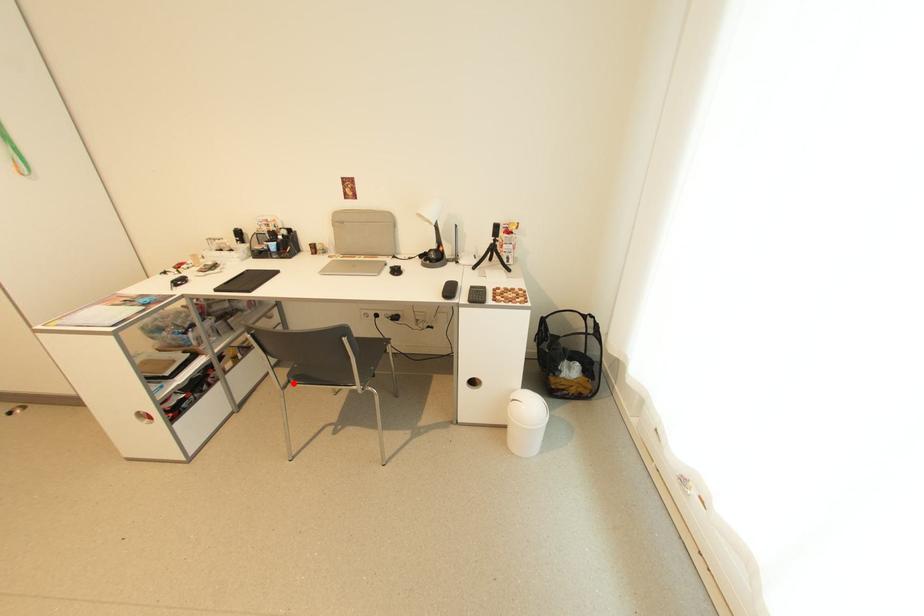
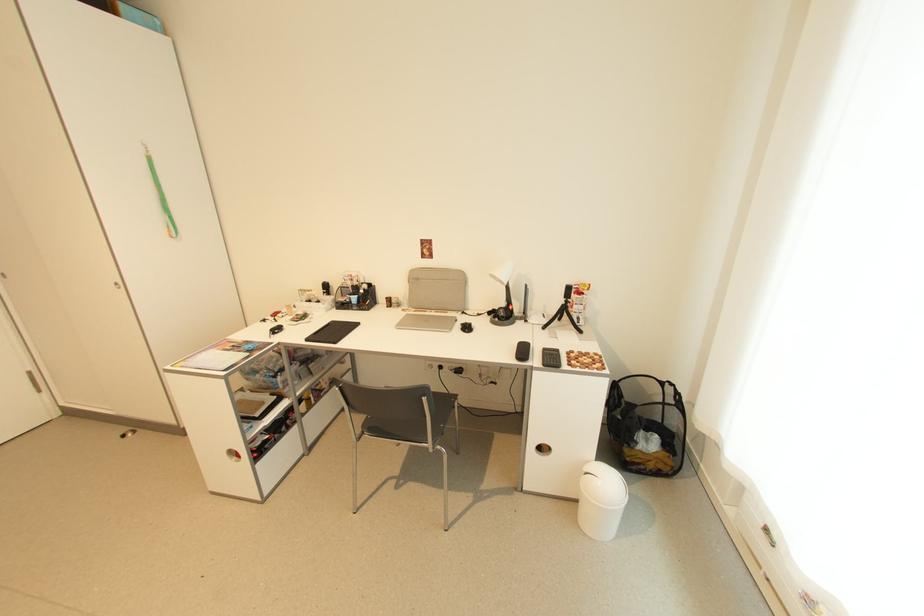
In the second image, find the point that corresponds to the highlighted location in the first image.

(368, 434)